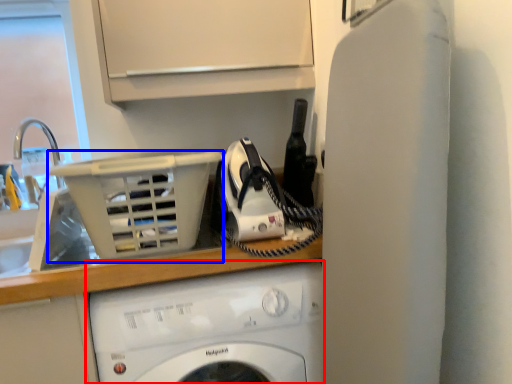
Question: Which point is further to the camera, washing machine (highlighted by a red box) or basket (highlighted by a blue box)?

Choices:
 (A) washing machine
 (B) basket

Answer: (A)